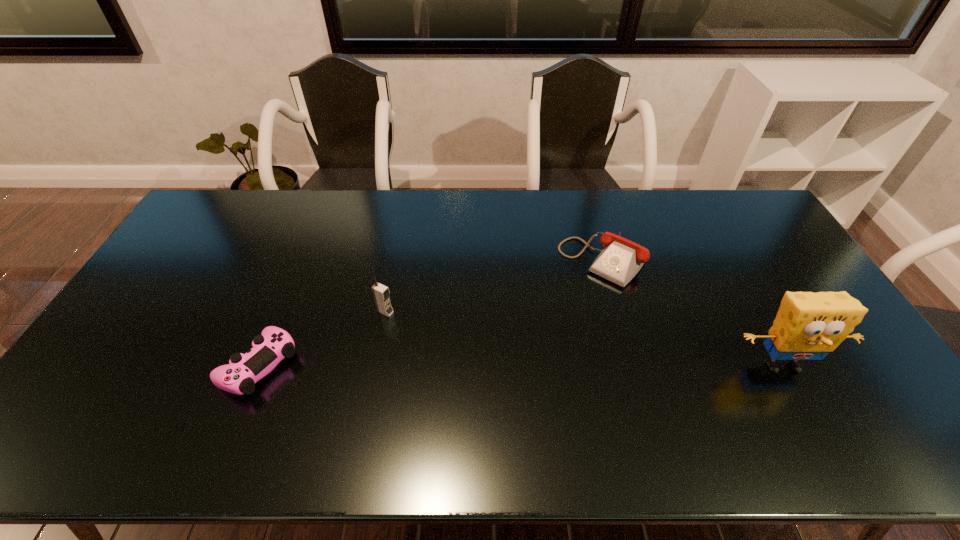
Find the location of a particular element. The width and height of the screenshot is (960, 540). free space on the desktop that is between the leftmost object and the rightmost object and is positioned on the front-facing side of the second farthest object is located at coordinates (492, 366).

Identify the location of vacant space on the desktop that is between the control and the sponge and is positioned on the dial of the third object from left to right. The height and width of the screenshot is (540, 960). (516, 366).